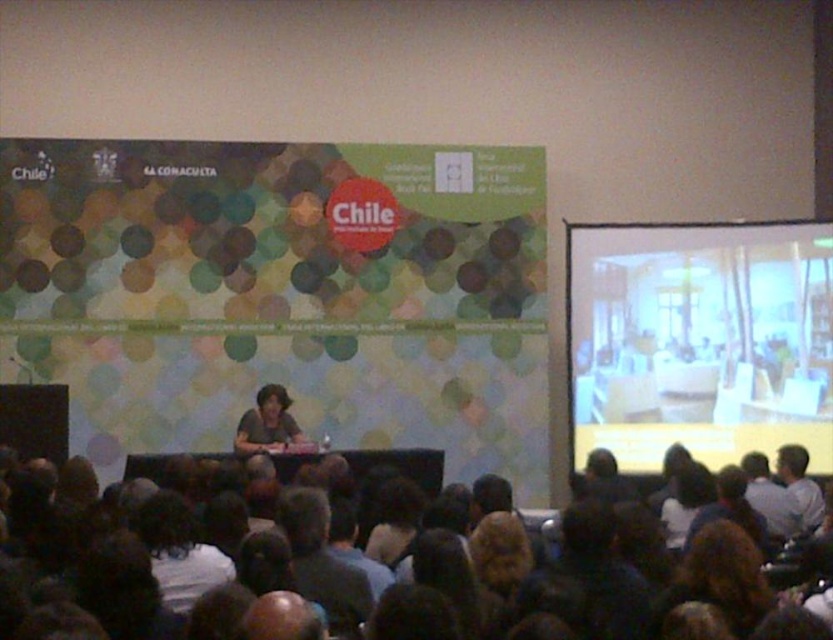
You are standing at the back of the conference hall and want to take a photo of the speaker wearing the dark gray shirt at center. If your camera has a maximum focus range of 4 meters, will you be able to capture a clear photo?

The dark gray shirt at center is 4.02 meters away from the camera. Since the camera can focus up to 4 meters, it cannot capture the speaker clearly as the distance exceeds the maximum focus range.

You are an attendee at the conference. You notice two shirts at the center of the stage. Which shirt is closer to you, the dark gray shirt at center or the matte black shirt at center?

The dark gray shirt at center is closer to you because it is positioned under the matte black shirt at center, meaning it is in front.